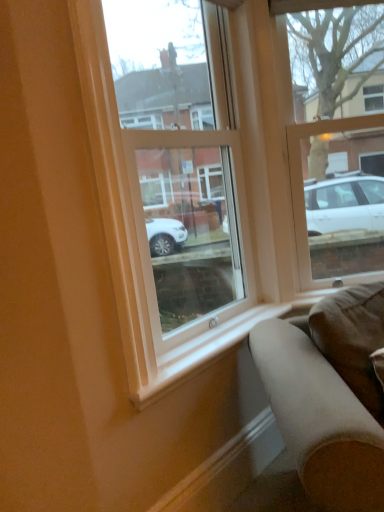
Question: Is clear glass window at upper right, the first window viewed from the right, shorter than white smooth window sill at lower center?

Choices:
 (A) yes
 (B) no

Answer: (B)

Question: Is clear glass window at upper right, the first window viewed from the right, wider than white smooth window sill at lower center?

Choices:
 (A) no
 (B) yes

Answer: (B)

Question: Is clear glass window at upper right, the 2th window in the left-to-right sequence, at the right side of white smooth window sill at lower center?

Choices:
 (A) yes
 (B) no

Answer: (A)

Question: Considering the relative positions of clear glass window at upper right, the 2th window in the left-to-right sequence, and white smooth window sill at lower center in the image provided, is clear glass window at upper right, the 2th window in the left-to-right sequence, to the left of white smooth window sill at lower center from the viewer's perspective?

Choices:
 (A) no
 (B) yes

Answer: (A)

Question: Is clear glass window at upper right, the first window viewed from the right, aimed at white smooth window sill at lower center?

Choices:
 (A) yes
 (B) no

Answer: (B)

Question: From a real-world perspective, does clear glass window at upper right, the first window viewed from the right, stand above white smooth window sill at lower center?

Choices:
 (A) yes
 (B) no

Answer: (A)

Question: Does transparent glass window at center, which appears as the 1th window when viewed from the left, lie behind clear glass window at upper right, the first window viewed from the right?

Choices:
 (A) yes
 (B) no

Answer: (B)

Question: Is transparent glass window at center, placed as the 2th window when sorted from right to left, to the right of clear glass window at upper right, the first window viewed from the right, from the viewer's perspective?

Choices:
 (A) yes
 (B) no

Answer: (B)

Question: Can you confirm if transparent glass window at center, placed as the 2th window when sorted from right to left, is bigger than clear glass window at upper right, the 2th window in the left-to-right sequence?

Choices:
 (A) no
 (B) yes

Answer: (B)

Question: Considering the relative sizes of transparent glass window at center, placed as the 2th window when sorted from right to left, and clear glass window at upper right, the first window viewed from the right, in the image provided, is transparent glass window at center, placed as the 2th window when sorted from right to left, wider than clear glass window at upper right, the first window viewed from the right,?

Choices:
 (A) no
 (B) yes

Answer: (B)

Question: Is transparent glass window at center, which appears as the 1th window when viewed from the left, smaller than clear glass window at upper right, the first window viewed from the right?

Choices:
 (A) yes
 (B) no

Answer: (B)

Question: Does transparent glass window at center, which appears as the 1th window when viewed from the left, have a greater height compared to clear glass window at upper right, the 2th window in the left-to-right sequence?

Choices:
 (A) yes
 (B) no

Answer: (A)

Question: Is suede-like brown couch at lower right surrounding white smooth window sill at lower center?

Choices:
 (A) no
 (B) yes

Answer: (A)